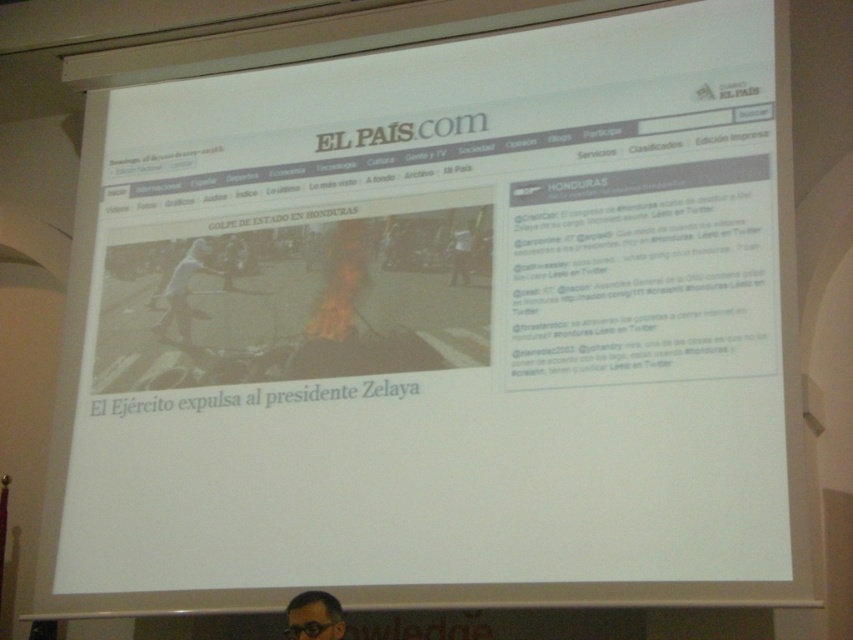
Question: Is matte black glasses at lower center bigger than black plastic goggles at lower center?

Choices:
 (A) yes
 (B) no

Answer: (A)

Question: Which point is farther to the camera?

Choices:
 (A) black plastic goggles at lower center
 (B) matte black glasses at lower center

Answer: (B)

Question: Can you confirm if matte black glasses at lower center is positioned to the right of black plastic goggles at lower center?

Choices:
 (A) no
 (B) yes

Answer: (B)

Question: Is matte black glasses at lower center smaller than black plastic goggles at lower center?

Choices:
 (A) yes
 (B) no

Answer: (B)

Question: Which point is farther to the camera?

Choices:
 (A) (329, 598)
 (B) (312, 627)

Answer: (A)